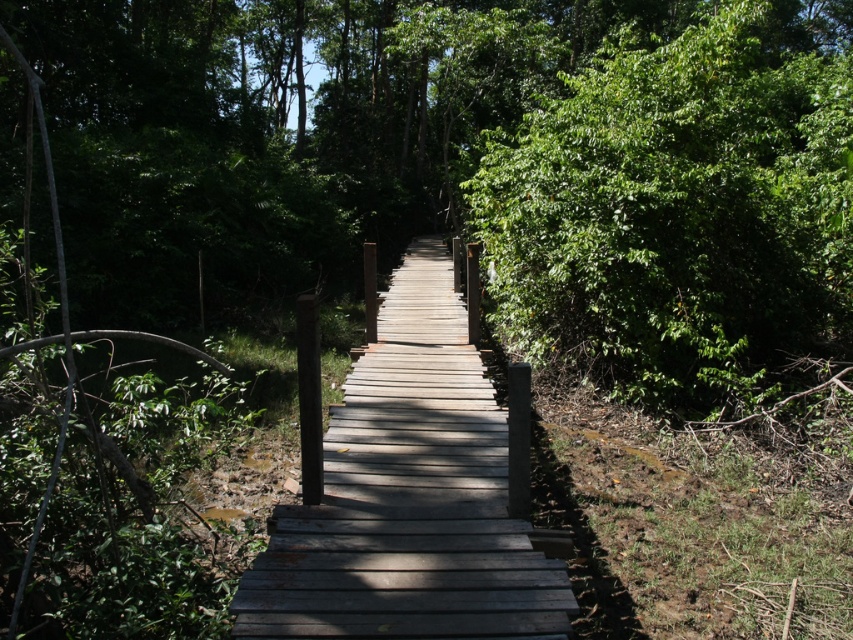
Question: Can you confirm if green leafy bush at right is positioned above gray wooden bridge at center?

Choices:
 (A) no
 (B) yes

Answer: (B)

Question: Is green leafy bush at right positioned at the back of gray wooden bridge at center?

Choices:
 (A) no
 (B) yes

Answer: (B)

Question: Is green leafy bush at right bigger than gray wooden bridge at center?

Choices:
 (A) no
 (B) yes

Answer: (B)

Question: Among these objects, which one is nearest to the camera?

Choices:
 (A) green leafy bush at right
 (B) gray wooden bridge at center

Answer: (B)

Question: Which point is closer to the camera?

Choices:
 (A) (776, 356)
 (B) (477, 488)

Answer: (B)